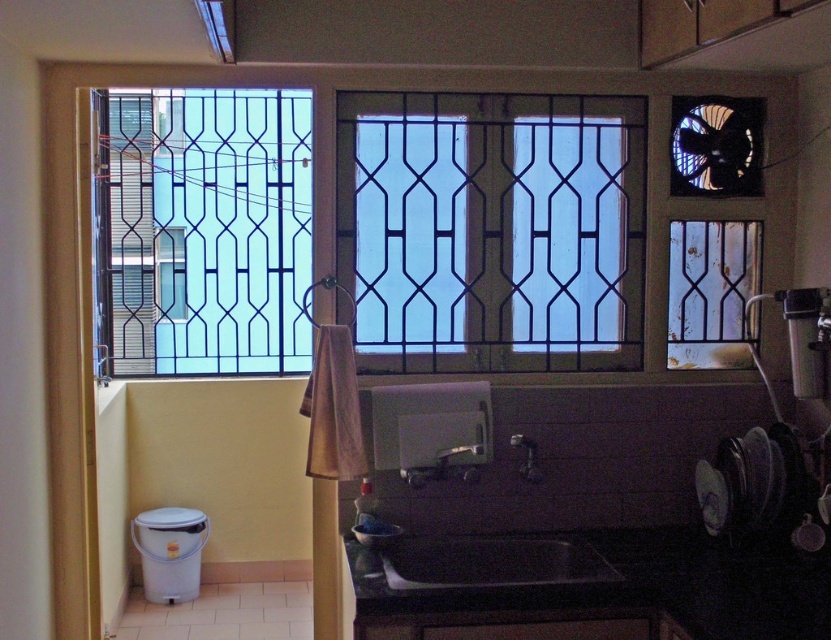
Question: Does black matte counter top at lower center appear under black matte sink at lower center?

Choices:
 (A) yes
 (B) no

Answer: (A)

Question: Observing the image, what is the correct spatial positioning of blue glass window at left in reference to metallic grid at upper right?

Choices:
 (A) above
 (B) below

Answer: (A)

Question: Which point appears closest to the camera in this image?

Choices:
 (A) (696, 627)
 (B) (524, 477)
 (C) (261, 216)

Answer: (A)

Question: Does clear glass window at center appear on the right side of satin nickel faucet at sink center?

Choices:
 (A) no
 (B) yes

Answer: (A)

Question: Which object is the closest to the metallic silver faucet at center?

Choices:
 (A) metallic grid at upper right
 (B) clear glass window at center

Answer: (B)

Question: Estimate the real-world distances between objects in this image. Which object is farther from the metallic grid at upper right?

Choices:
 (A) clear glass window at center
 (B) blue glass window at left
 (C) black matte counter top at lower center

Answer: (B)